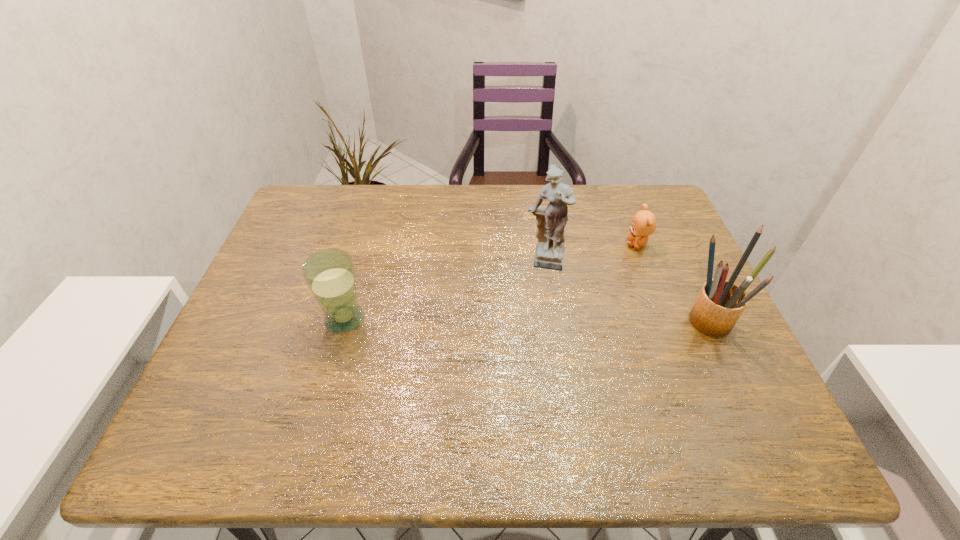
Find the location of a particular element. This screenshot has width=960, height=540. vacant area located 0.290m on the face of the teddy bear is located at coordinates (571, 308).

Identify the location of vacant space located on the front-facing side of the figurine. (545, 398).

Find the location of a particular element. The width and height of the screenshot is (960, 540). vacant space located 0.160m on the front-facing side of the figurine is located at coordinates (545, 326).

What are the coordinates of `free spot located 0.140m on the front-facing side of the figurine` in the screenshot? It's located at (545, 320).

Find the location of a particular element. pencil box located in the right edge section of the desktop is located at coordinates [720, 303].

Identify the location of teddy bear at the right edge. (643, 224).

I want to click on vacant space at the far edge of the desktop, so click(x=471, y=184).

Find the location of `vacant region at the near edge of the desktop`. vacant region at the near edge of the desktop is located at coordinates (411, 391).

At what (x,y) coordinates should I click in order to perform the action: click on blank area at the left edge. Please return your answer as a coordinate pair (x, y). The width and height of the screenshot is (960, 540). Looking at the image, I should click on (330, 234).

In the image, there is a desktop. Where is `free region at the right edge`? free region at the right edge is located at coordinates (681, 314).